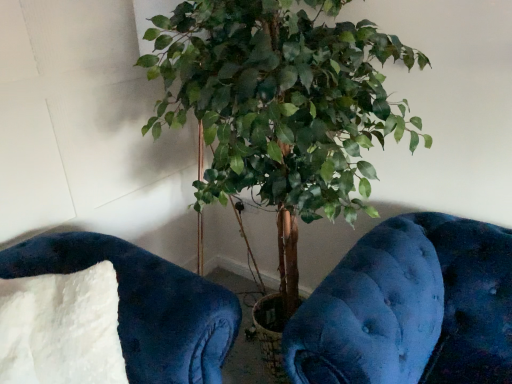
This screenshot has height=384, width=512. What do you see at coordinates (280, 107) in the screenshot? I see `green leafy plant at center` at bounding box center [280, 107].

Where is `velvety blue cushion at lower left`? This screenshot has height=384, width=512. velvety blue cushion at lower left is located at coordinates (145, 305).

The height and width of the screenshot is (384, 512). What do you see at coordinates (61, 328) in the screenshot?
I see `white fluffy pillow at lower left` at bounding box center [61, 328].

Where is `green leafy plant at center`? The width and height of the screenshot is (512, 384). green leafy plant at center is located at coordinates (280, 107).

From the image's perspective, is green leafy plant at center beneath white fluffy pillow at lower left?

Actually, green leafy plant at center appears above white fluffy pillow at lower left in the image.

From the picture: Is green leafy plant at center bigger or smaller than white fluffy pillow at lower left?

green leafy plant at center is bigger than white fluffy pillow at lower left.

Can you tell me how much green leafy plant at center and white fluffy pillow at lower left differ in facing direction?

There is a 55.8-degree angle between the facing directions of green leafy plant at center and white fluffy pillow at lower left.

Is green leafy plant at center not inside white fluffy pillow at lower left?

Yes, green leafy plant at center is outside of white fluffy pillow at lower left.

Considering the sizes of white fluffy pillow at lower left and green leafy plant at center in the image, is white fluffy pillow at lower left bigger or smaller than green leafy plant at center?

Considering their sizes, white fluffy pillow at lower left takes up less space than green leafy plant at center.

At what (x,y) coordinates should I click in order to perform the action: click on pillow that appears below the green leafy plant at center (from the image's perspective). Please return your answer as a coordinate pair (x, y). Looking at the image, I should click on (61, 328).

Between white fluffy pillow at lower left and green leafy plant at center, which one has more height?

green leafy plant at center is taller.

Who is more distant, white fluffy pillow at lower left or green leafy plant at center?

Positioned behind is white fluffy pillow at lower left.

Which is in front, velvety blue cushion at lower left or white fluffy pillow at lower left?

white fluffy pillow at lower left is in front.

From the image's perspective, between velvety blue cushion at lower left and white fluffy pillow at lower left, which one is located above?

velvety blue cushion at lower left appears higher in the image.

Considering the sizes of objects velvety blue cushion at lower left and white fluffy pillow at lower left in the image provided, who is bigger, velvety blue cushion at lower left or white fluffy pillow at lower left?

With larger size is velvety blue cushion at lower left.

Could you tell me if velvety blue cushion at lower left is facing white fluffy pillow at lower left?

Yes, velvety blue cushion at lower left faces towards white fluffy pillow at lower left.

Is velvety blue cushion at lower left aimed at green leafy plant at center?

No, velvety blue cushion at lower left is not oriented towards green leafy plant at center.

Which object is closer to the camera, velvety blue cushion at lower left or green leafy plant at center?

green leafy plant at center is in front.

From the image's perspective, which one is positioned higher, velvety blue cushion at lower left or green leafy plant at center?

green leafy plant at center is shown above in the image.

Can we say velvety blue cushion at lower left lies outside green leafy plant at center?

velvety blue cushion at lower left is positioned outside green leafy plant at center.

Which is behind, point (347, 194) or point (28, 259)?

Point (28, 259)

Considering the positions of objects green leafy plant at center and velvety blue cushion at lower left in the image provided, who is more to the left, green leafy plant at center or velvety blue cushion at lower left?

Positioned to the left is velvety blue cushion at lower left.

Is green leafy plant at center outside of velvety blue cushion at lower left?

green leafy plant at center lies outside velvety blue cushion at lower left's area.

Is green leafy plant at center looking in the opposite direction of velvety blue cushion at lower left?

No, velvety blue cushion at lower left is not at the back of green leafy plant at center.

Would you say white fluffy pillow at lower left is outside velvety blue cushion at lower left?

That's incorrect, white fluffy pillow at lower left is not completely outside velvety blue cushion at lower left.

Is point (41, 311) farther from viewer compared to point (167, 310)?

Yes, point (41, 311) is farther from viewer.

How different are the orientations of white fluffy pillow at lower left and velvety blue cushion at lower left in degrees?

The facing directions of white fluffy pillow at lower left and velvety blue cushion at lower left are 28.6 degrees apart.

Who is smaller, white fluffy pillow at lower left or velvety blue cushion at lower left?

white fluffy pillow at lower left is smaller.

The image size is (512, 384). I want to click on pillow below the green leafy plant at center (from a real-world perspective), so click(61, 328).

Locate an element on the screen. The image size is (512, 384). houseplant lying above the white fluffy pillow at lower left (from the image's perspective) is located at coordinates pos(280,107).

Which object lies nearer to the anchor point white fluffy pillow at lower left, green leafy plant at center or velvety blue cushion at lower left?

The object closer to white fluffy pillow at lower left is velvety blue cushion at lower left.

When comparing their distances from velvety blue cushion at lower left, does green leafy plant at center or white fluffy pillow at lower left seem further?

Among the two, green leafy plant at center is located further to velvety blue cushion at lower left.

Which object lies nearer to the anchor point green leafy plant at center, white fluffy pillow at lower left or velvety blue cushion at lower left?

velvety blue cushion at lower left.

Based on their spatial positions, is velvety blue cushion at lower left or white fluffy pillow at lower left further from green leafy plant at center?

white fluffy pillow at lower left lies further to green leafy plant at center than the other object.

Estimate the real-world distances between objects in this image. Which object is closer to velvety blue cushion at lower left, white fluffy pillow at lower left or green leafy plant at center?

Based on the image, white fluffy pillow at lower left appears to be nearer to velvety blue cushion at lower left.

Looking at the image, which one is located further to white fluffy pillow at lower left, velvety blue cushion at lower left or green leafy plant at center?

Among the two, green leafy plant at center is located further to white fluffy pillow at lower left.

This screenshot has height=384, width=512. What are the coordinates of `furniture located between white fluffy pillow at lower left and green leafy plant at center in the left-right direction` in the screenshot? It's located at (145, 305).